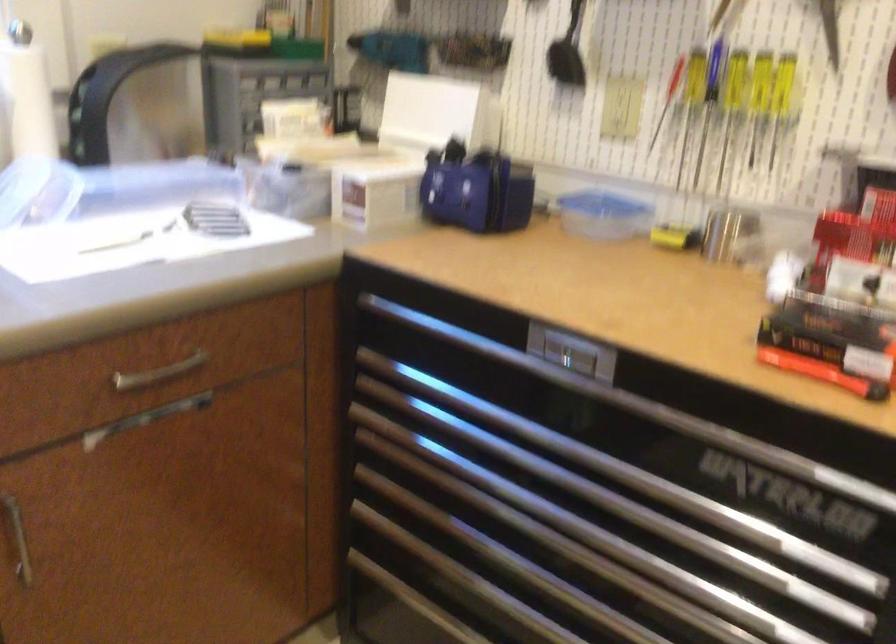
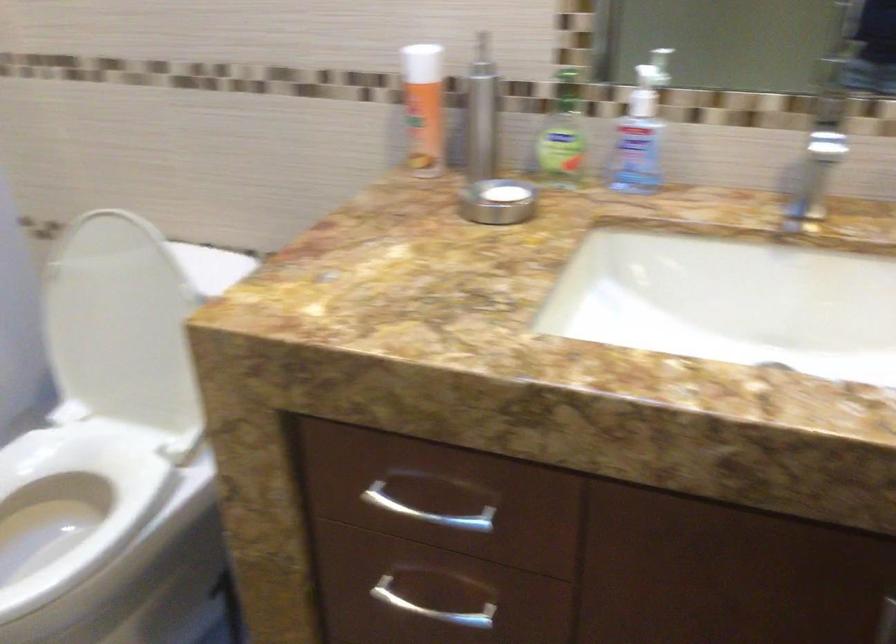
In the scene shown: In a continuous first-person perspective shot, in which direction is the camera moving?

The movement direction of the cameraman is right, backward.